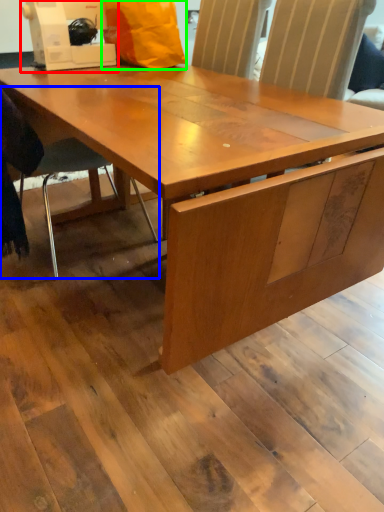
Question: Which object is the closest to the sewing machine (highlighted by a red box)? Choose among these: chair (highlighted by a blue box) or paper bag (highlighted by a green box).

Choices:
 (A) chair
 (B) paper bag

Answer: (B)